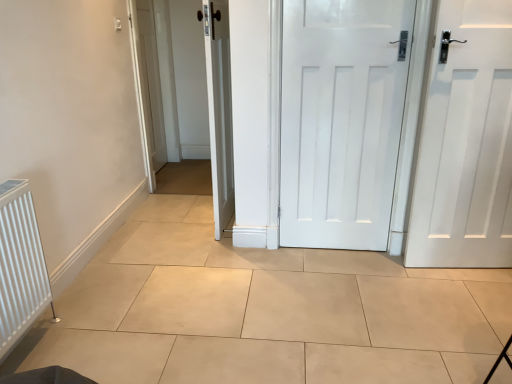
Question: Is white matte door at center, the 2th door from the right, positioned before white matte door at right, which is the 1th door in right-to-left order?

Choices:
 (A) yes
 (B) no

Answer: (B)

Question: Is white matte door at center, the 2th door from the right, far away from white matte door at right, placed as the third door when sorted from left to right?

Choices:
 (A) no
 (B) yes

Answer: (A)

Question: From a real-world perspective, is white matte door at center, marked as the second door in a left-to-right arrangement, located beneath white matte door at right, which is the 1th door in right-to-left order?

Choices:
 (A) yes
 (B) no

Answer: (B)

Question: Is white matte door at center, marked as the second door in a left-to-right arrangement, oriented away from white matte door at right, which is the 1th door in right-to-left order?

Choices:
 (A) no
 (B) yes

Answer: (A)

Question: Considering the relative positions of white matte door at center, marked as the second door in a left-to-right arrangement, and white matte door at right, which is the 1th door in right-to-left order, in the image provided, is white matte door at center, marked as the second door in a left-to-right arrangement, to the left of white matte door at right, which is the 1th door in right-to-left order, from the viewer's perspective?

Choices:
 (A) no
 (B) yes

Answer: (B)

Question: From a real-world perspective, is white matte door at right, placed as the third door when sorted from left to right, physically located above or below white wooden door at center, which is counted as the 3th door, starting from the right?

Choices:
 (A) above
 (B) below

Answer: (B)

Question: From the image's perspective, is white matte door at right, placed as the third door when sorted from left to right, above or below white wooden door at center, the 1th door in the left-to-right sequence?

Choices:
 (A) above
 (B) below

Answer: (B)

Question: Is white matte door at right, placed as the third door when sorted from left to right, taller or shorter than white wooden door at center, the 1th door in the left-to-right sequence?

Choices:
 (A) tall
 (B) short

Answer: (B)

Question: Is white matte door at right, placed as the third door when sorted from left to right, situated inside white wooden door at center, the 1th door in the left-to-right sequence, or outside?

Choices:
 (A) inside
 (B) outside

Answer: (B)

Question: Considering the positions of point (209, 39) and point (330, 150), is point (209, 39) closer or farther from the camera than point (330, 150)?

Choices:
 (A) closer
 (B) farther

Answer: (A)

Question: Is white wooden door at center, the 1th door in the left-to-right sequence, to the left or to the right of white matte door at center, marked as the second door in a left-to-right arrangement, in the image?

Choices:
 (A) left
 (B) right

Answer: (A)

Question: Considering the positions of white wooden door at center, the 1th door in the left-to-right sequence, and white matte door at center, the 2th door from the right, in the image, is white wooden door at center, the 1th door in the left-to-right sequence, wider or thinner than white matte door at center, the 2th door from the right,?

Choices:
 (A) wide
 (B) thin

Answer: (A)

Question: Is white wooden door at center, the 1th door in the left-to-right sequence, in front of or behind white matte door at center, the 2th door from the right, in the image?

Choices:
 (A) behind
 (B) front

Answer: (A)

Question: Relative to white ribbed radiator at left, is white matte door at center, the 2th door from the right, in front or behind?

Choices:
 (A) behind
 (B) front

Answer: (A)

Question: Which is correct: white matte door at center, marked as the second door in a left-to-right arrangement, is inside white ribbed radiator at left, or outside of it?

Choices:
 (A) inside
 (B) outside

Answer: (B)